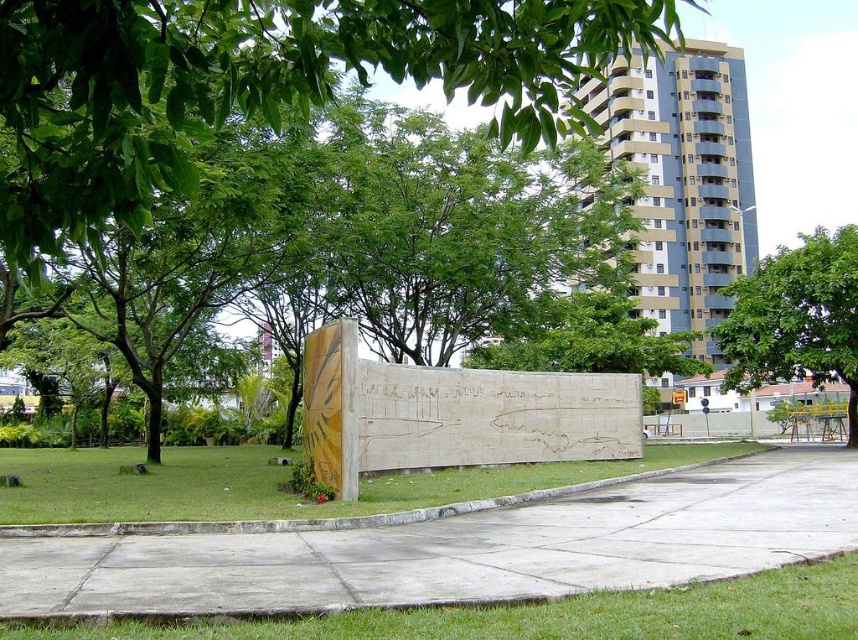
Question: Estimate the real-world distances between objects in this image. Which object is closer to the green leafy tree at right?

Choices:
 (A) green grass at lower center
 (B) green leafy tree at upper center

Answer: (B)

Question: Observing the image, what is the correct spatial positioning of gray concrete pavement at center in reference to green leafy tree at right?

Choices:
 (A) above
 (B) below

Answer: (B)

Question: Which of these objects is positioned closest to the green grass at lower left?

Choices:
 (A) green leafy tree at right
 (B) green leafy tree at upper center

Answer: (B)

Question: Does green leafy tree at upper center have a greater width compared to green leafy tree at right?

Choices:
 (A) no
 (B) yes

Answer: (A)

Question: Does green leafy tree at upper center appear on the right side of gray concrete pavement at center?

Choices:
 (A) no
 (B) yes

Answer: (A)

Question: Among these points, which one is farthest from the camera?

Choices:
 (A) [x=237, y=108]
 (B) [x=732, y=291]
 (C) [x=411, y=500]

Answer: (B)